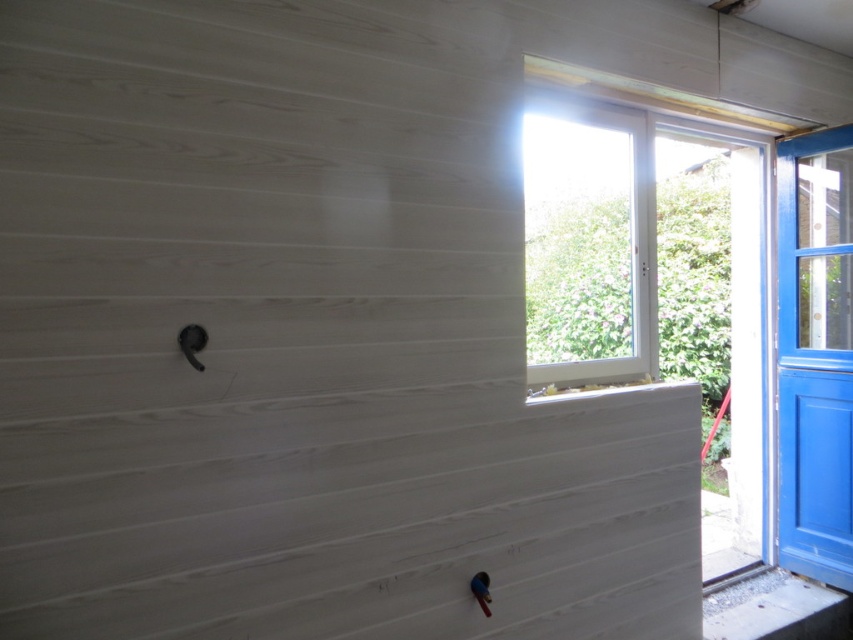
You are standing in the room and want to look outside. Where is the white plastic window at upper center located in the room?

The white plastic window at upper center is located at point (x=587, y=243) in the room.

You are a delivery person who needs to place a package on the floor. The package is 6 feet long. You see the white plastic window at upper center and the black door handle on the left wall. Can you fit the package horizontally between them?

The distance between the white plastic window at upper center and the black door handle on the left wall is 6.78 feet. Since the package is 6 feet long, it can fit horizontally between them as 6.78 feet is greater than 6 feet.